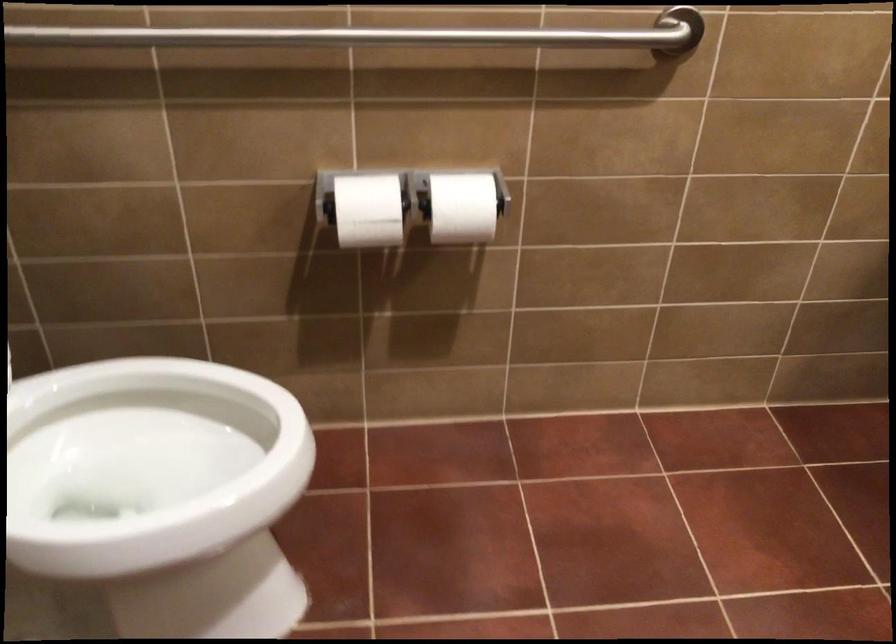
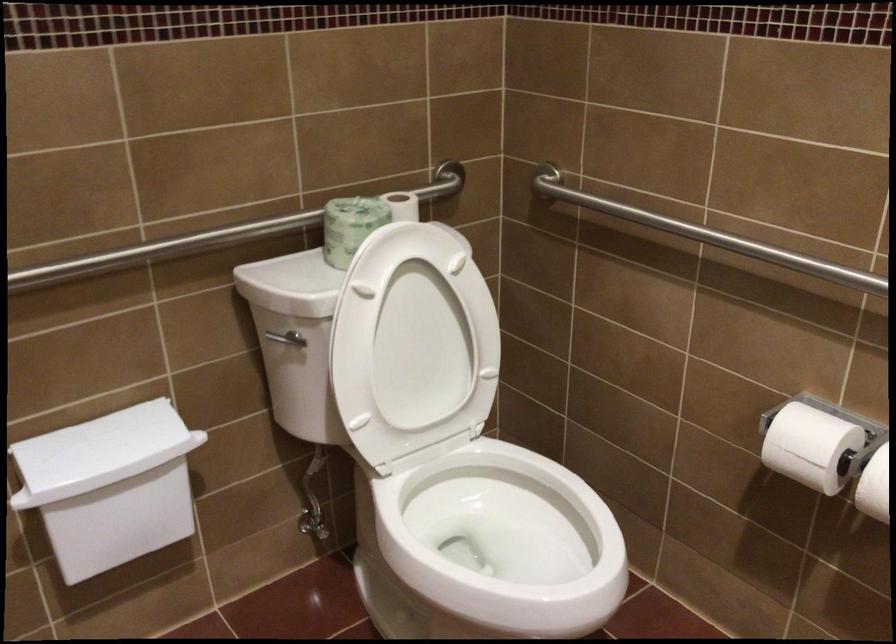
Find the pixel in the second image that matches point 131,484 in the first image.

(497, 544)